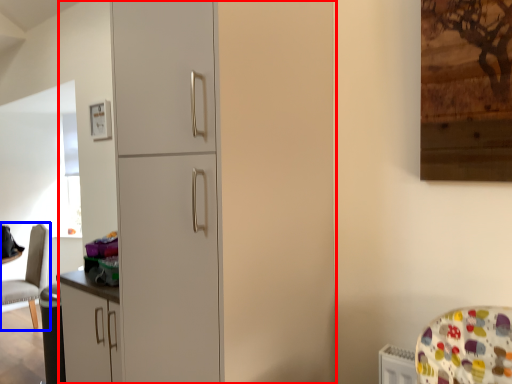
Question: Which point is closer to the camera, dresser (highlighted by a red box) or chair (highlighted by a blue box)?

Choices:
 (A) dresser
 (B) chair

Answer: (A)